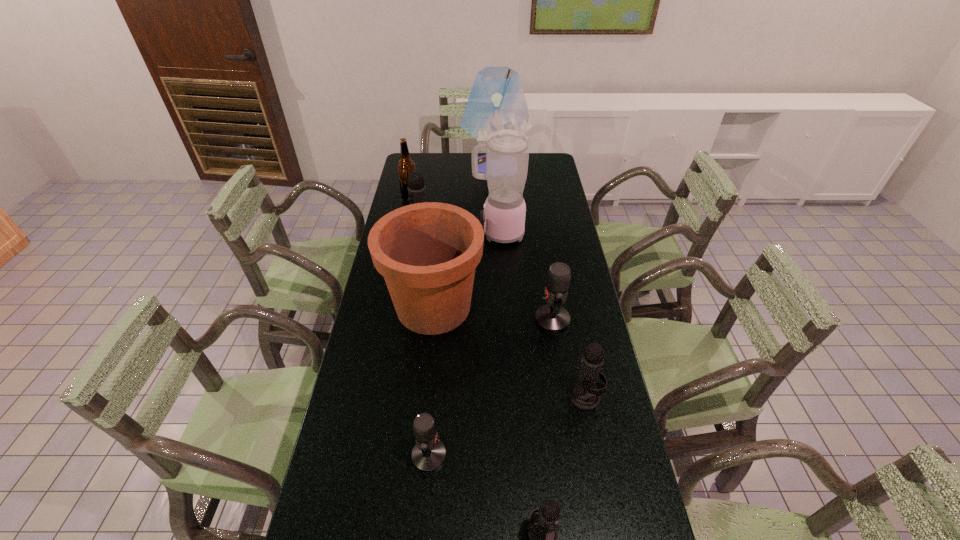
This screenshot has height=540, width=960. I want to click on the farthest object, so click(496, 102).

Where is `light lampshade`? This screenshot has width=960, height=540. light lampshade is located at coordinates (496, 102).

Identify the location of food processor. (507, 151).

Identify the location of flowerpot. This screenshot has width=960, height=540. (427, 252).

This screenshot has width=960, height=540. I want to click on the second farthest object, so click(406, 166).

In order to click on the leftmost microphone in this screenshot , I will do `click(416, 187)`.

Find the location of `the farthest microphone`. the farthest microphone is located at coordinates (416, 187).

This screenshot has height=540, width=960. Identify the location of the second farthest microphone. (552, 317).

The width and height of the screenshot is (960, 540). I want to click on the right red microphone, so click(552, 317).

Where is `the second biggest black microphone`? Image resolution: width=960 pixels, height=540 pixels. the second biggest black microphone is located at coordinates (585, 395).